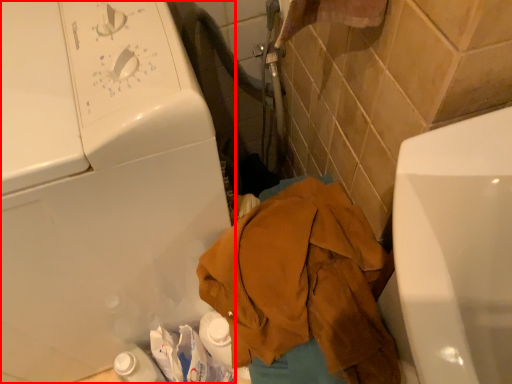
Question: From the image's perspective, where is washing machine (annotated by the red box) located in relation to clothing in the image?

Choices:
 (A) below
 (B) above

Answer: (B)